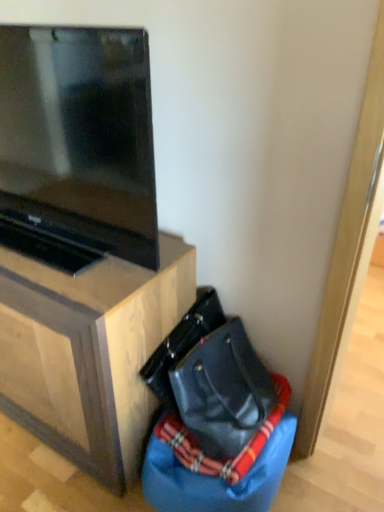
Describe the element at coordinates (218, 465) in the screenshot. The width and height of the screenshot is (384, 512). I see `blue fabric bean bag chair at lower right` at that location.

Where is `matte black tv at upper left`? The height and width of the screenshot is (512, 384). matte black tv at upper left is located at coordinates (80, 136).

Can you confirm if matte black tv at upper left is bigger than black leather messenger bag at lower right?

Yes, matte black tv at upper left is bigger than black leather messenger bag at lower right.

Can you confirm if matte black tv at upper left is thinner than black leather messenger bag at lower right?

No, matte black tv at upper left is not thinner than black leather messenger bag at lower right.

Which object is closer to the camera taking this photo, matte black tv at upper left or black leather messenger bag at lower right?

matte black tv at upper left.

Is wooden tv stand at lower left directly adjacent to matte black tv at upper left?

No, wooden tv stand at lower left is not touching matte black tv at upper left.

Looking at this image, does wooden tv stand at lower left have a greater height compared to matte black tv at upper left?

Indeed, wooden tv stand at lower left has a greater height compared to matte black tv at upper left.

Considering the sizes of objects wooden tv stand at lower left and matte black tv at upper left in the image provided, who is thinner, wooden tv stand at lower left or matte black tv at upper left?

matte black tv at upper left.

From the image's perspective, between wooden tv stand at lower left and matte black tv at upper left, who is located below?

From the image's view, wooden tv stand at lower left is below.

Is blue fabric bean bag chair at lower right at the back of wooden tv stand at lower left?

wooden tv stand at lower left is not turned away from blue fabric bean bag chair at lower right.

Is wooden tv stand at lower left in front of or behind blue fabric bean bag chair at lower right in the image?

Clearly, wooden tv stand at lower left is in front of blue fabric bean bag chair at lower right.

Is wooden tv stand at lower left placed right next to blue fabric bean bag chair at lower right?

No, wooden tv stand at lower left is not making contact with blue fabric bean bag chair at lower right.

Considering the sizes of objects wooden tv stand at lower left and blue fabric bean bag chair at lower right in the image provided, who is smaller, wooden tv stand at lower left or blue fabric bean bag chair at lower right?

blue fabric bean bag chair at lower right.

From a real-world perspective, which object rests below the other?

In real-world perspective, blue fabric bean bag chair at lower right is lower.

Which object is positioned more to the right, blue fabric bean bag chair at lower right or matte black tv at upper left?

blue fabric bean bag chair at lower right.

From their relative heights in the image, would you say blue fabric bean bag chair at lower right is taller or shorter than matte black tv at upper left?

Clearly, blue fabric bean bag chair at lower right is shorter compared to matte black tv at upper left.

Looking at this image, who is smaller, blue fabric bean bag chair at lower right or matte black tv at upper left?

Smaller between the two is blue fabric bean bag chair at lower right.

Would you say wooden tv stand at lower left is part of black leather messenger bag at lower right's contents?

No, black leather messenger bag at lower right does not contain wooden tv stand at lower left.

Based on the photo, considering the relative positions of black leather messenger bag at lower right and wooden tv stand at lower left in the image provided, is black leather messenger bag at lower right behind wooden tv stand at lower left?

Yes, the depth of black leather messenger bag at lower right is greater than that of wooden tv stand at lower left.

This screenshot has width=384, height=512. Find the location of `furniture above the black leather messenger bag at lower right (from the image's perspective)`. furniture above the black leather messenger bag at lower right (from the image's perspective) is located at coordinates (89, 352).

Can you confirm if black leather messenger bag at lower right is wider than wooden tv stand at lower left?

In fact, black leather messenger bag at lower right might be narrower than wooden tv stand at lower left.

Who is smaller, matte black tv at upper left or wooden tv stand at lower left?

With smaller size is matte black tv at upper left.

Choose the correct answer: Is matte black tv at upper left inside wooden tv stand at lower left or outside it?

matte black tv at upper left cannot be found inside wooden tv stand at lower left.

Where is `furniture behind the matte black tv at upper left`? The image size is (384, 512). furniture behind the matte black tv at upper left is located at coordinates (89, 352).

Would you say blue fabric bean bag chair at lower right is outside black leather messenger bag at lower right?

Absolutely, blue fabric bean bag chair at lower right is external to black leather messenger bag at lower right.

In the scene shown: From the image's perspective, which one is positioned lower, blue fabric bean bag chair at lower right or black leather messenger bag at lower right?

From the image's view, blue fabric bean bag chair at lower right is below.

Who is smaller, blue fabric bean bag chair at lower right or black leather messenger bag at lower right?

black leather messenger bag at lower right is smaller.

This screenshot has width=384, height=512. I want to click on messenger bag behind the matte black tv at upper left, so click(x=182, y=345).

At what (x,y) coordinates should I click in order to perform the action: click on television located in front of the wooden tv stand at lower left. Please return your answer as a coordinate pair (x, y). Image resolution: width=384 pixels, height=512 pixels. Looking at the image, I should click on (80, 136).

When comparing their distances from black leather messenger bag at lower right, does matte black tv at upper left or wooden tv stand at lower left seem further?

matte black tv at upper left is further to black leather messenger bag at lower right.

When comparing their distances from blue fabric bean bag chair at lower right, does black leather messenger bag at lower right or matte black tv at upper left seem closer?

Among the two, black leather messenger bag at lower right is located nearer to blue fabric bean bag chair at lower right.

Estimate the real-world distances between objects in this image. Which object is closer to blue fabric bean bag chair at lower right, wooden tv stand at lower left or black leather messenger bag at lower right?

black leather messenger bag at lower right lies closer to blue fabric bean bag chair at lower right than the other object.

From the image, which object appears to be nearer to matte black tv at upper left, blue fabric bean bag chair at lower right or wooden tv stand at lower left?

The object closer to matte black tv at upper left is wooden tv stand at lower left.

Consider the image. Looking at the image, which one is located closer to black leather messenger bag at lower right, matte black tv at upper left or blue fabric bean bag chair at lower right?

Among the two, blue fabric bean bag chair at lower right is located nearer to black leather messenger bag at lower right.

Considering their positions, is wooden tv stand at lower left positioned further to matte black tv at upper left than black leather messenger bag at lower right?

Among the two, black leather messenger bag at lower right is located further to matte black tv at upper left.

From the image, which object appears to be farther from blue fabric bean bag chair at lower right, matte black tv at upper left or black leather messenger bag at lower right?

matte black tv at upper left is further to blue fabric bean bag chair at lower right.

From the image, which object appears to be farther from matte black tv at upper left, blue fabric bean bag chair at lower right or black leather messenger bag at lower right?

blue fabric bean bag chair at lower right.

You are a GUI agent. You are given a task and a screenshot of the screen. Output one action in this format:
    pyautogui.click(x=<x>, y=<y>)
    Task: Click on the messenger bag situated between wooden tv stand at lower left and blue fabric bean bag chair at lower right from left to right
    This screenshot has width=384, height=512.
    Given the screenshot: What is the action you would take?
    pyautogui.click(x=182, y=345)

Identify the location of messenger bag between matte black tv at upper left and blue fabric bean bag chair at lower right in the up-down direction. (182, 345).

Find the location of `furniture between matte black tv at upper left and blue fabric bean bag chair at lower right from top to bottom`. furniture between matte black tv at upper left and blue fabric bean bag chair at lower right from top to bottom is located at coordinates (89, 352).

Where is `television situated between wooden tv stand at lower left and black leather messenger bag at lower right from left to right`? This screenshot has width=384, height=512. television situated between wooden tv stand at lower left and black leather messenger bag at lower right from left to right is located at coordinates (80, 136).